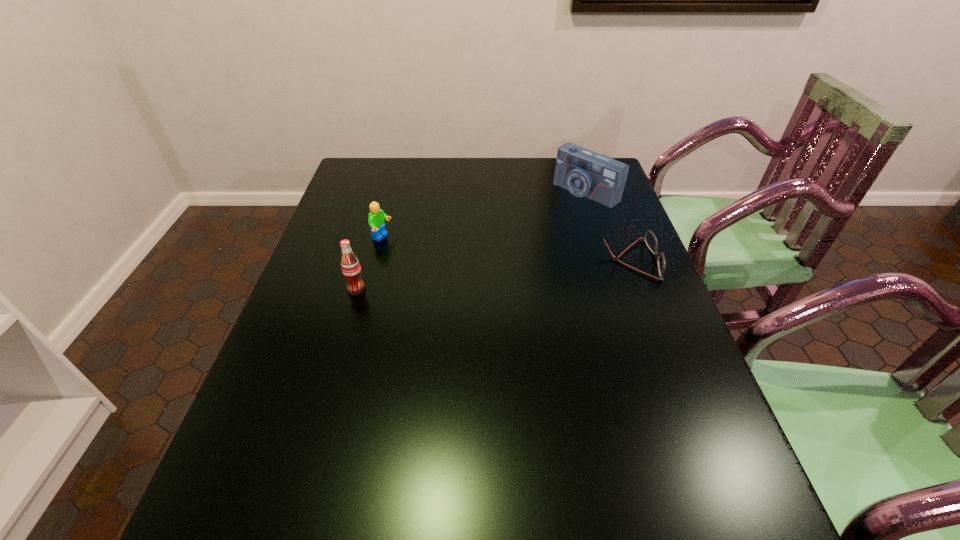
At what (x,y) coordinates should I click in order to perform the action: click on free space between the nearest object and the shortest object. Please return your answer as a coordinate pair (x, y). The height and width of the screenshot is (540, 960). Looking at the image, I should click on (493, 274).

At what (x,y) coordinates should I click in order to perform the action: click on free area in between the soda and the farthest object. Please return your answer as a coordinate pair (x, y). Image resolution: width=960 pixels, height=540 pixels. Looking at the image, I should click on (471, 241).

Choose which object is the third nearest neighbor to the shortest object. Please provide its 2D coordinates. Your answer should be formatted as a tuple, i.e. [(x, y)], where the tuple contains the x and y coordinates of a point satisfying the conditions above.

[(350, 266)]

Identify which object is the third nearest to the camera. Please provide its 2D coordinates. Your answer should be formatted as a tuple, i.e. [(x, y)], where the tuple contains the x and y coordinates of a point satisfying the conditions above.

[(350, 266)]

Locate an element on the screen. This screenshot has width=960, height=540. free location that satisfies the following two spatial constraints: 1. on the back side of the shortest object; 2. on the front-facing side of the soda is located at coordinates (365, 260).

This screenshot has width=960, height=540. Find the location of `vacant space that satisfies the following two spatial constraints: 1. on the back side of the nearest object; 2. on the right side of the second shortest object`. vacant space that satisfies the following two spatial constraints: 1. on the back side of the nearest object; 2. on the right side of the second shortest object is located at coordinates (372, 238).

At what (x,y) coordinates should I click in order to perform the action: click on free space that satisfies the following two spatial constraints: 1. on the back side of the spectacles; 2. on the front-facing side of the soda. Please return your answer as a coordinate pair (x, y). Looking at the image, I should click on (365, 260).

The width and height of the screenshot is (960, 540). I want to click on free spot that satisfies the following two spatial constraints: 1. on the front side of the spectacles; 2. on the front-facing side of the camera, so click(608, 260).

You are a GUI agent. You are given a task and a screenshot of the screen. Output one action in this format:
    pyautogui.click(x=<x>, y=<y>)
    Task: Click on the free point that satisfies the following two spatial constraints: 1. on the back side of the shortest object; 2. on the front-facing side of the soda
    Image resolution: width=960 pixels, height=540 pixels.
    Given the screenshot: What is the action you would take?
    pyautogui.click(x=365, y=260)

Find the location of a particular element. Image resolution: width=960 pixels, height=540 pixels. vacant region that satisfies the following two spatial constraints: 1. on the front side of the shortest object; 2. on the front-facing side of the second shortest object is located at coordinates (376, 260).